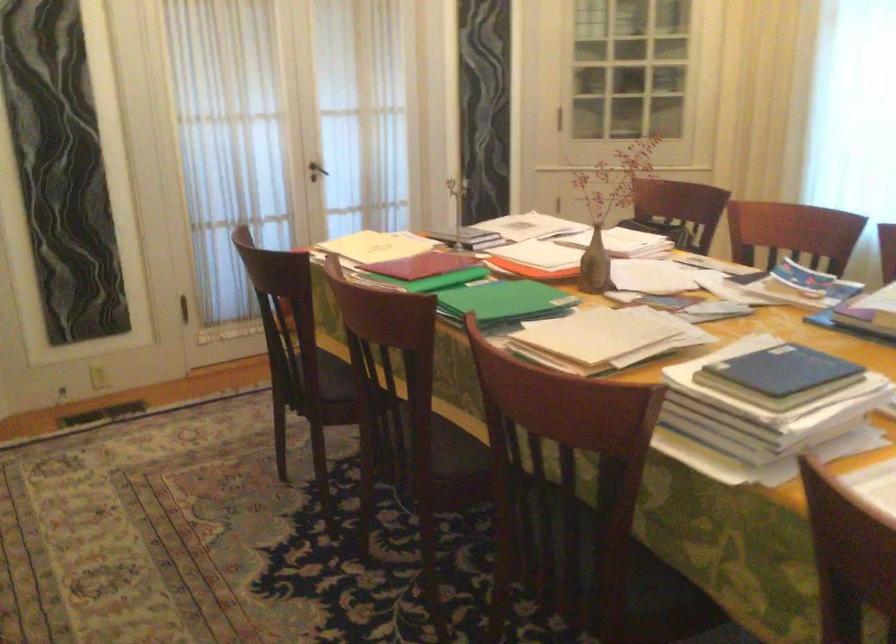
Find where to pull the dark door handle. Please return your answer as a coordinate pair (x, y).

(316, 171)